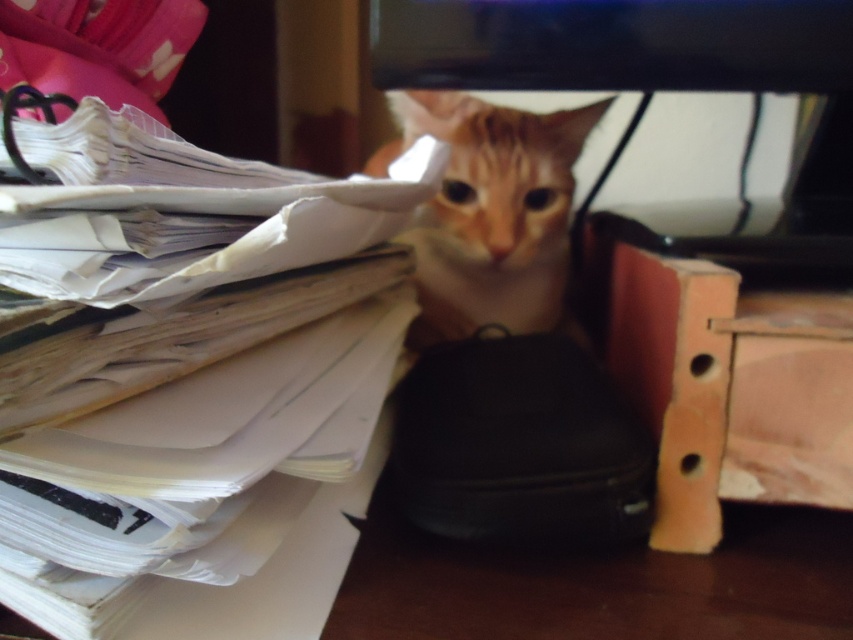
Question: Which point is farther from the camera taking this photo?

Choices:
 (A) (445, 100)
 (B) (308, 554)

Answer: (A)

Question: Among these points, which one is nearest to the camera?

Choices:
 (A) pos(427,332)
 (B) pos(225,291)
 (C) pos(567,358)

Answer: (B)

Question: Is white paper at left wider than black matte bag at center?

Choices:
 (A) yes
 (B) no

Answer: (A)

Question: Does black matte bag at center appear on the right side of orange fur cat at center?

Choices:
 (A) yes
 (B) no

Answer: (B)

Question: Can you confirm if black matte bag at center is positioned to the left of orange fur cat at center?

Choices:
 (A) no
 (B) yes

Answer: (B)

Question: Based on their relative distances, which object is farther from the black matte bag at center?

Choices:
 (A) orange fur cat at center
 (B) white paper at left

Answer: (A)